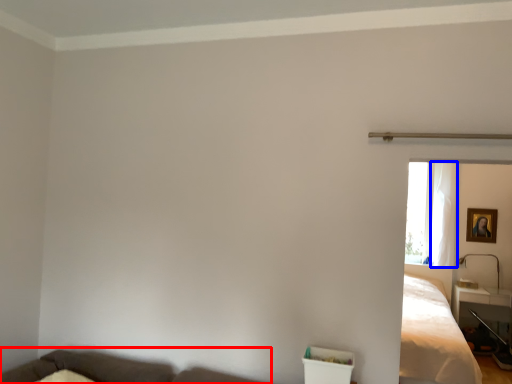
Question: Among these objects, which one is nearest to the camera, couch (highlighted by a red box) or curtain (highlighted by a blue box)?

Choices:
 (A) couch
 (B) curtain

Answer: (A)